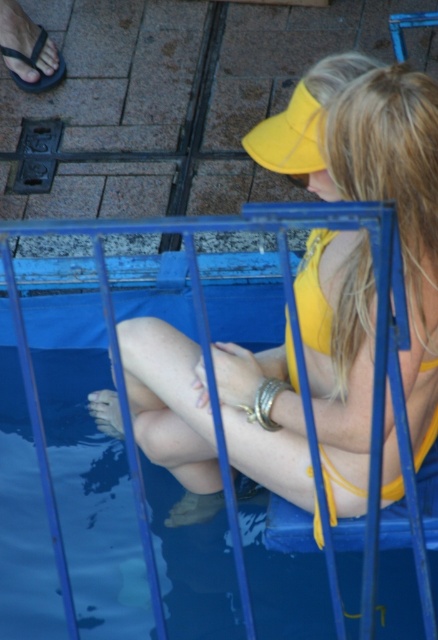
Question: Considering the real-world distances, which object is farthest from the yellow matte bikini top at center?

Choices:
 (A) black rubber sandal at upper left
 (B) blue plastic pool at center
 (C) yellow fabric bikini top at upper center

Answer: (A)

Question: Is blue plastic pool at center wider than yellow fabric bikini top at upper center?

Choices:
 (A) no
 (B) yes

Answer: (B)

Question: In this image, where is yellow matte bikini top at center located relative to black rubber sandal at upper left?

Choices:
 (A) left
 (B) right

Answer: (B)

Question: Which of these objects is positioned closest to the black rubber sandal at upper left?

Choices:
 (A) yellow fabric bikini top at upper center
 (B) blue plastic pool at center

Answer: (A)

Question: Among these objects, which one is nearest to the camera?

Choices:
 (A) black rubber sandal at upper left
 (B) blue plastic pool at center
 (C) yellow matte bikini top at center
 (D) yellow fabric bikini top at upper center

Answer: (B)

Question: Can you confirm if yellow matte bikini top at center is smaller than black rubber sandal at upper left?

Choices:
 (A) yes
 (B) no

Answer: (B)